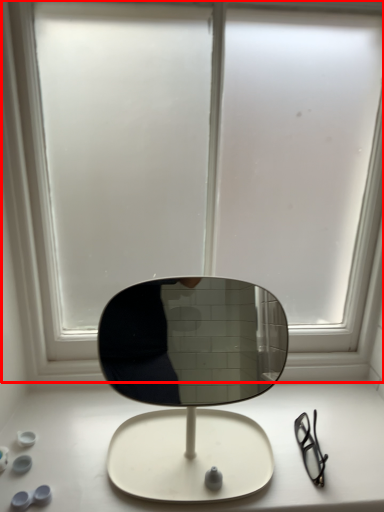
Question: From the image's perspective, considering the relative positions of window (annotated by the red box) and table top in the image provided, where is window (annotated by the red box) located with respect to the staircase?

Choices:
 (A) below
 (B) above

Answer: (B)